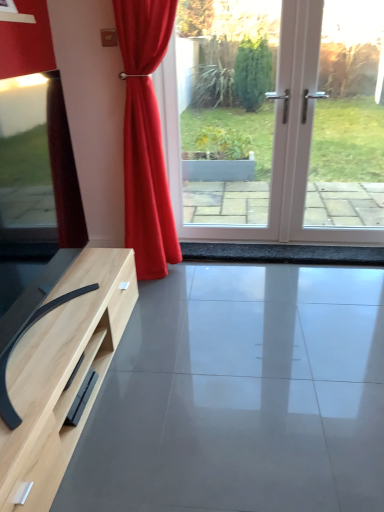
Where is `vacant space situated above matte wood tv stand at lower left (from a real-world perspective)`? The image size is (384, 512). vacant space situated above matte wood tv stand at lower left (from a real-world perspective) is located at coordinates (265, 346).